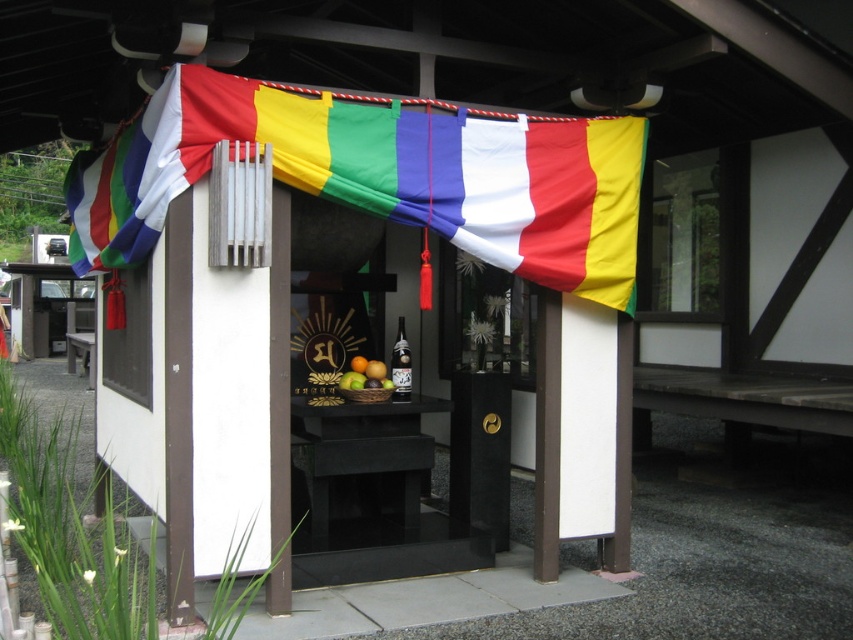
Can you confirm if multicolored fabric banner at upper center is thinner than glossy wooden bowl at center?

No.

Can you confirm if multicolored fabric banner at upper center is positioned to the left of glossy wooden bowl at center?

Yes, multicolored fabric banner at upper center is to the left of glossy wooden bowl at center.

Is point (219, 81) positioned in front of point (363, 376)?

Yes.

Identify the location of multicolored fabric banner at upper center. (381, 177).